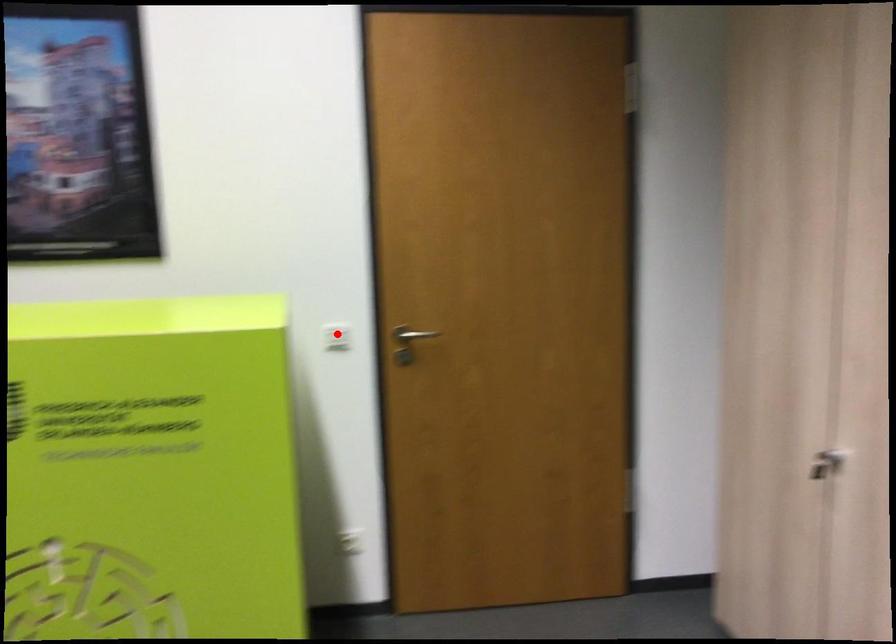
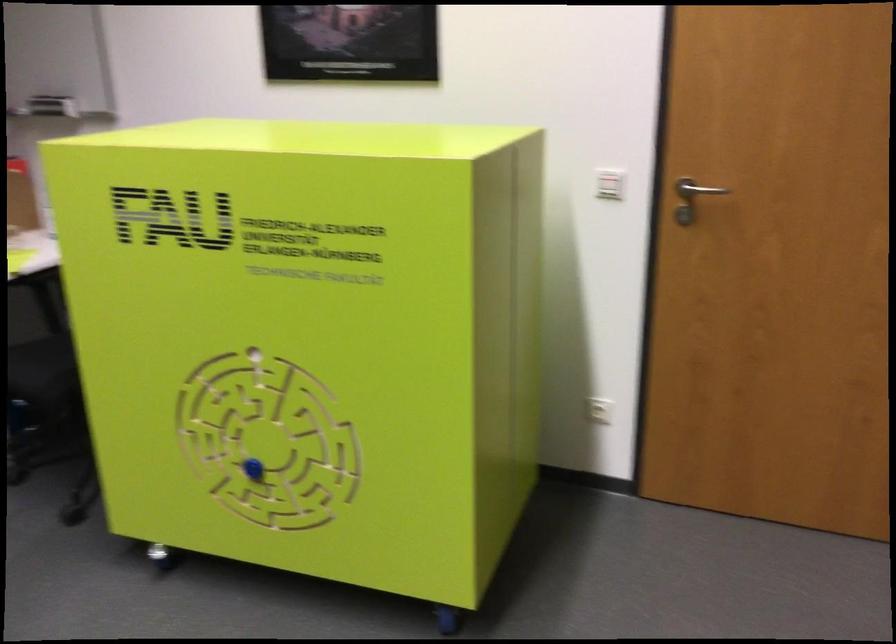
Where in the second image is the point corresponding to the highlighted location from the first image?

(609, 184)